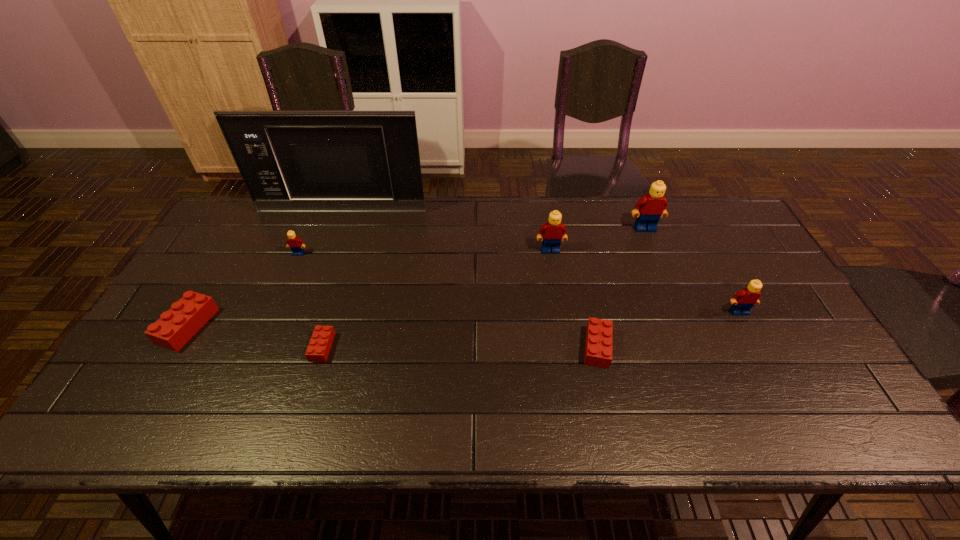
What are the coordinates of `free point between the third tallest object and the fifth tallest object` in the screenshot? It's located at (424, 252).

At what (x,y) coordinates should I click in order to perform the action: click on blank region between the second red Lego from left to right and the second Lego from right to left. Please return your answer as a coordinate pair (x, y). Looking at the image, I should click on (484, 288).

Where is `vacant space that is in between the farthest object and the fourth shortest Lego`? vacant space that is in between the farthest object and the fourth shortest Lego is located at coordinates (321, 232).

The image size is (960, 540). Identify the location of free space between the sixth shortest object and the biggest red Lego. (370, 288).

This screenshot has height=540, width=960. Identify the location of vacant point located between the second smallest yellow Lego and the rightmost red Lego. (668, 329).

The image size is (960, 540). Identify the location of the sixth closest object relative to the seventh tallest object. (294, 243).

Locate an element on the screen. This screenshot has height=540, width=960. object that is the seventh closest to the leftmost red Lego is located at coordinates (744, 300).

Locate an element on the screen. The image size is (960, 540). Lego identified as the sixth closest to the smallest red Lego is located at coordinates (744, 300).

Identify which Lego is the fifth nearest to the third biggest yellow Lego. Please provide its 2D coordinates. Your answer should be formatted as a tuple, i.e. [(x, y)], where the tuple contains the x and y coordinates of a point satisfying the conditions above.

[(294, 243)]

Identify which yellow Lego is located as the third nearest to the rightmost red Lego. Please provide its 2D coordinates. Your answer should be formatted as a tuple, i.e. [(x, y)], where the tuple contains the x and y coordinates of a point satisfying the conditions above.

[(653, 205)]